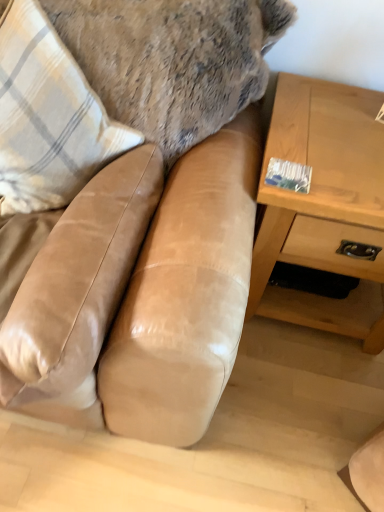
Question: Is plaid fabric pillow at left completely or partially inside tan leather couch at center?

Choices:
 (A) yes
 (B) no

Answer: (A)

Question: Is tan leather couch at center positioned in front of plaid fabric pillow at left?

Choices:
 (A) yes
 (B) no

Answer: (A)

Question: Does tan leather couch at center have a lesser height compared to plaid fabric pillow at left?

Choices:
 (A) no
 (B) yes

Answer: (A)

Question: Does tan leather couch at center come behind plaid fabric pillow at left?

Choices:
 (A) yes
 (B) no

Answer: (B)

Question: Is tan leather couch at center at the left side of plaid fabric pillow at left?

Choices:
 (A) no
 (B) yes

Answer: (A)

Question: Can you confirm if tan leather couch at center is taller than plaid fabric pillow at left?

Choices:
 (A) no
 (B) yes

Answer: (B)

Question: From the image's perspective, is light brown wood table at right over plaid fabric pillow at left?

Choices:
 (A) yes
 (B) no

Answer: (B)

Question: From the image's perspective, is light brown wood table at right below plaid fabric pillow at left?

Choices:
 (A) no
 (B) yes

Answer: (B)

Question: Is light brown wood table at right not close to plaid fabric pillow at left?

Choices:
 (A) no
 (B) yes

Answer: (A)

Question: Is light brown wood table at right positioned before plaid fabric pillow at left?

Choices:
 (A) yes
 (B) no

Answer: (B)

Question: Can you confirm if light brown wood table at right is taller than plaid fabric pillow at left?

Choices:
 (A) no
 (B) yes

Answer: (B)

Question: Is light brown wood table at right oriented towards plaid fabric pillow at left?

Choices:
 (A) yes
 (B) no

Answer: (B)

Question: From a real-world perspective, is plaid fabric pillow at left located higher than tan leather couch at center?

Choices:
 (A) no
 (B) yes

Answer: (B)